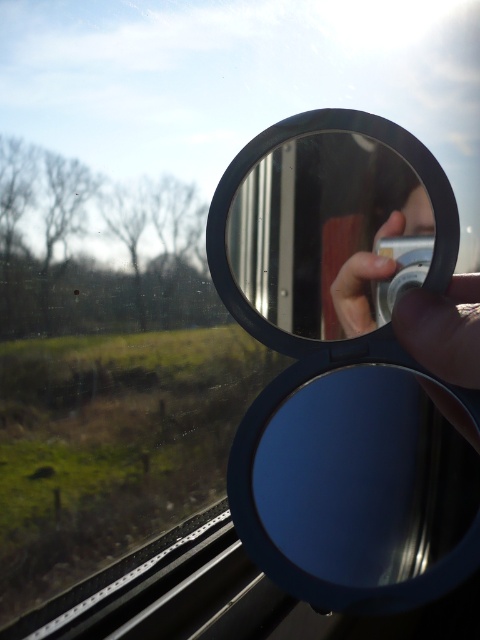
You are a photographer trying to capture the reflection of the rural landscape outside the train window. You have a blue matte view mirror at center and a blue metallic magnifying glass at center. Which object should you use to see the reflection of the fence on the right side of the mirror?

The blue metallic magnifying glass at center is to the right of the blue matte view mirror at center, so using the blue metallic magnifying glass at center would allow you to see the reflection of the fence on the right side.

You are a photographer trying to capture a reflection of the landscape outside the train window in the blue matte view mirror at center. To ensure the reflection is clear, you need to position your camera exactly 30 centimeters away from the mirror. Can you do this successfully?

The blue matte view mirror at center and viewer are 30.62 centimeters apart, so yes, you can position your camera successfully because the distance between them is slightly more than 30 centimeters.